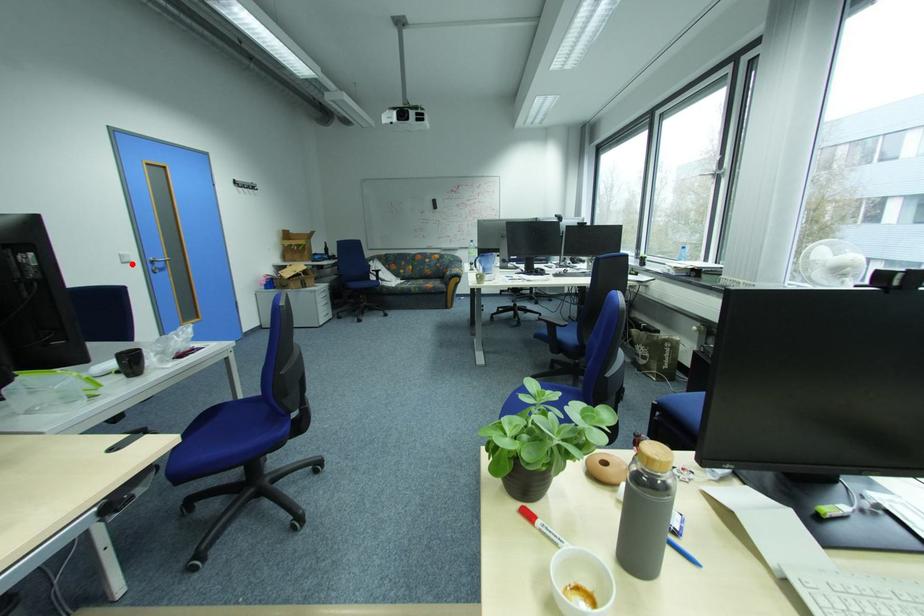
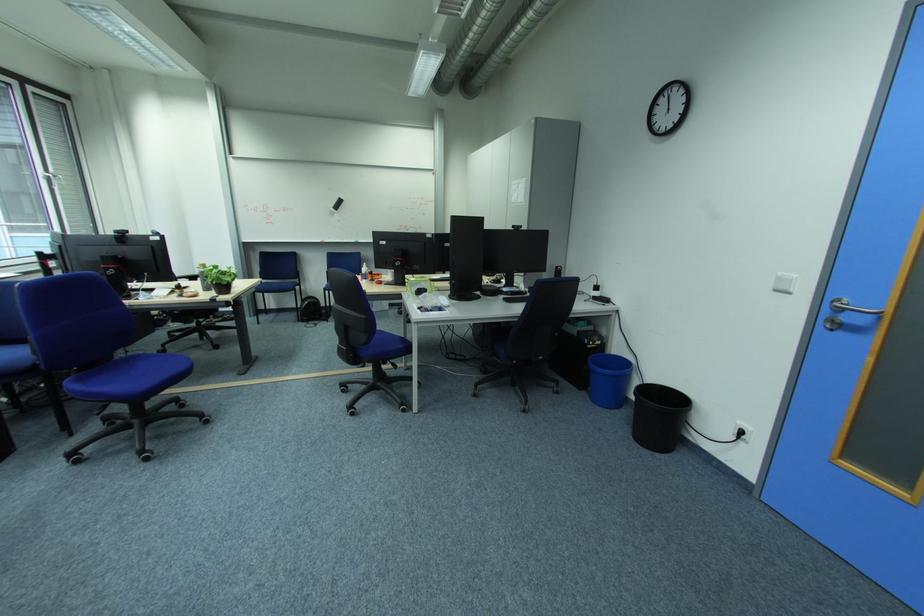
The point at the highlighted location is marked in the first image. Where is the corresponding point in the second image?

(785, 292)